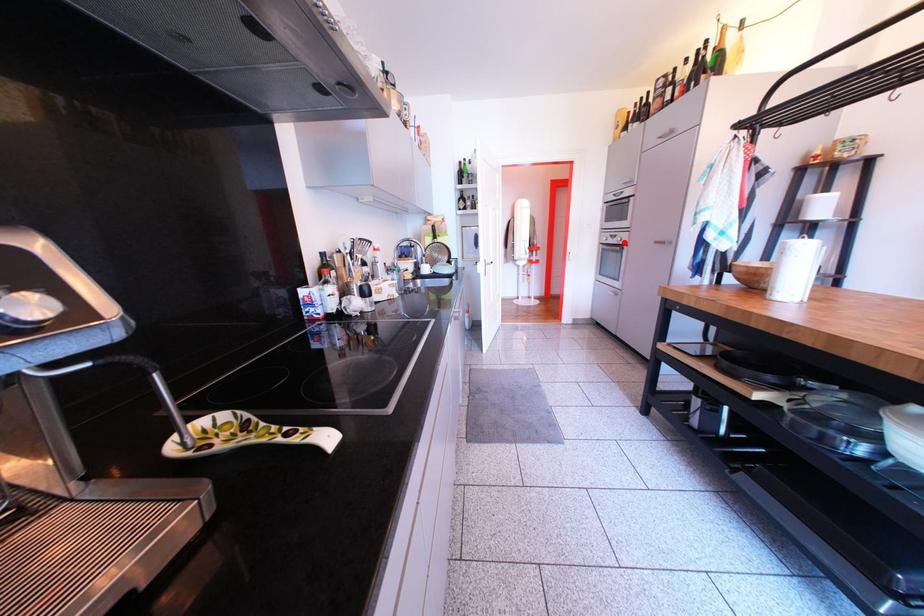
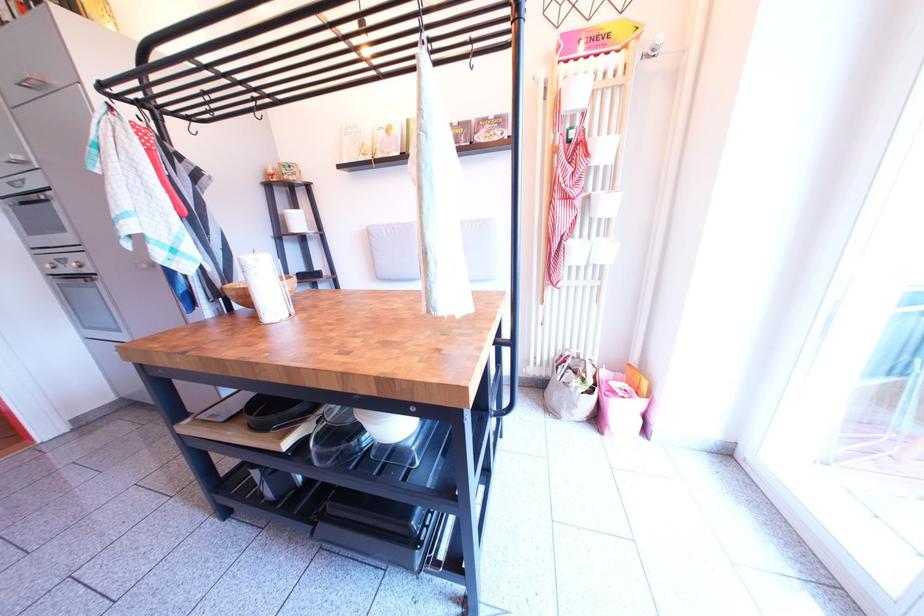
Question: I am providing you with two images of the same scene from different viewpoints. In image1, a red point is highlighted. Considering the same 3D point in image2, which of the following is correct?

Choices:
 (A) It is closer
 (B) It is farther

Answer: (B)